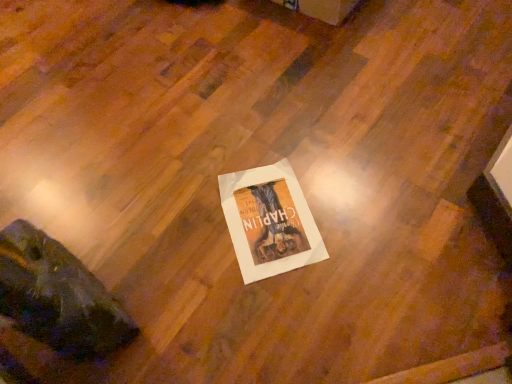
I want to click on free space in front of white paper book at center, so click(x=282, y=315).